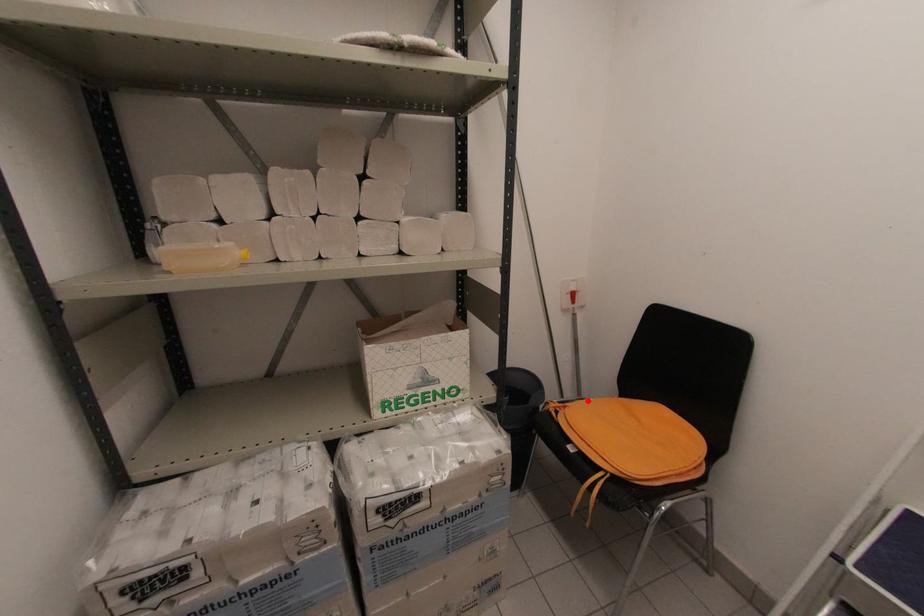
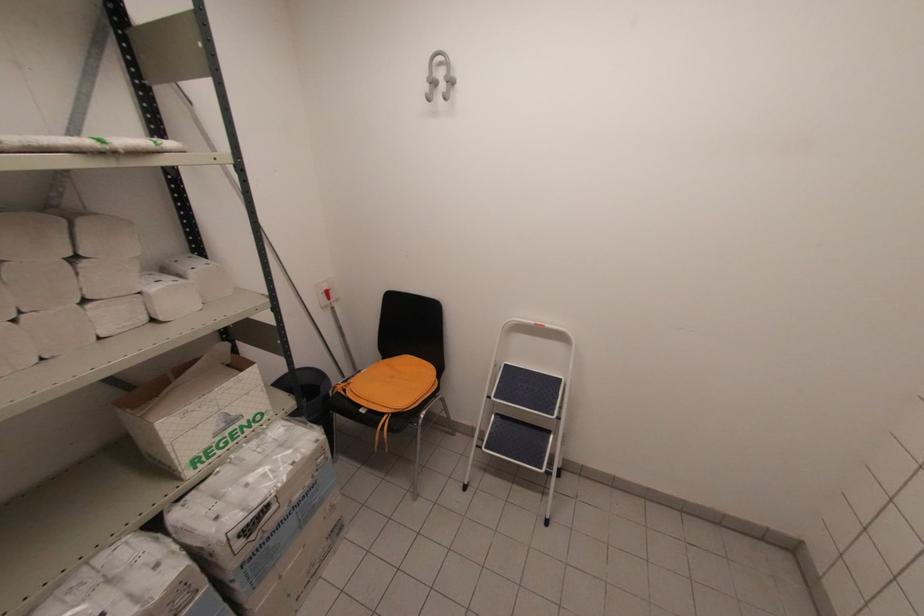
In the second image, find the point that corresponds to the highlighted location in the first image.

(362, 371)